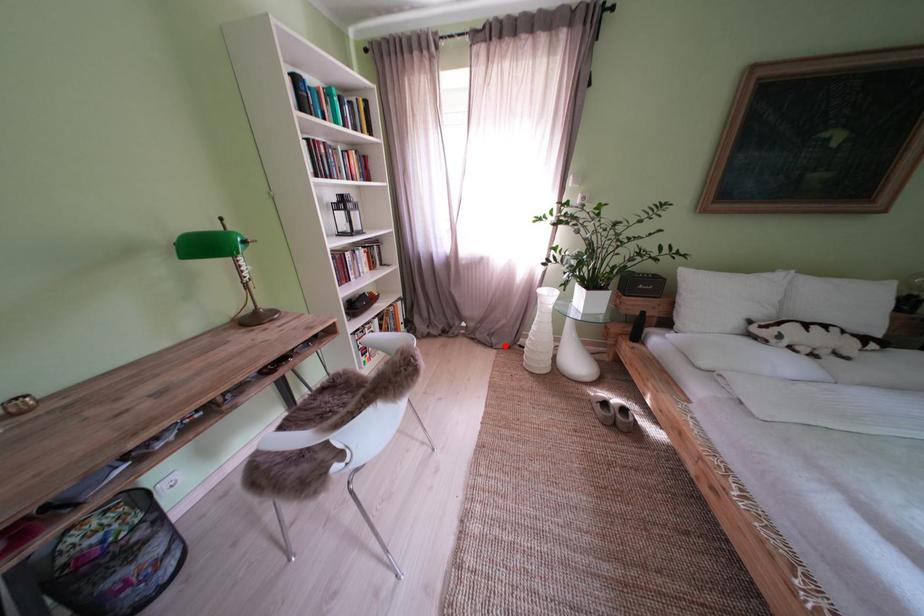
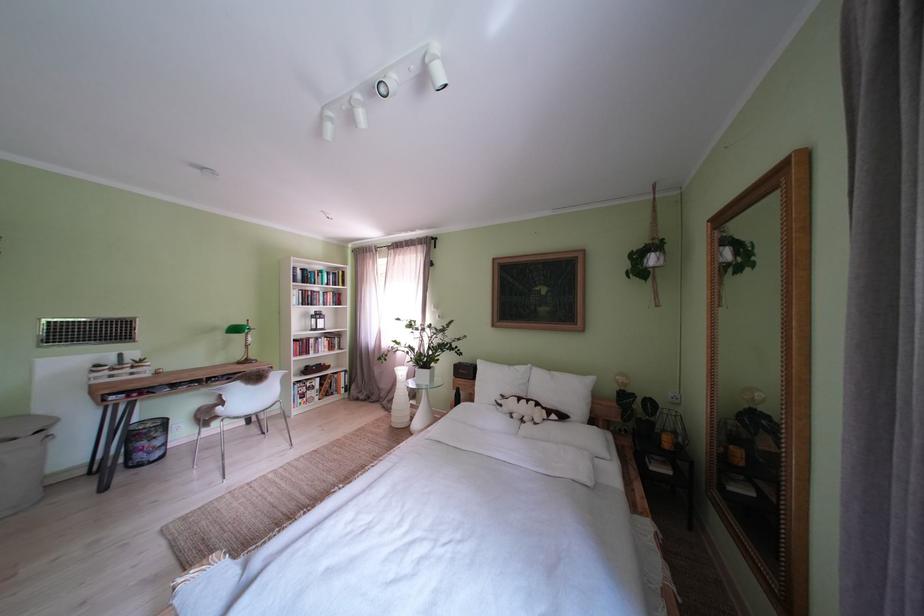
Question: A red point is marked in image1. In image2, is the corresponding 3D point closer to the camera or farther? Reply with the corresponding letter.

Choices:
 (A) The corresponding 3D point is closer.
 (B) The corresponding 3D point is farther.

Answer: (B)